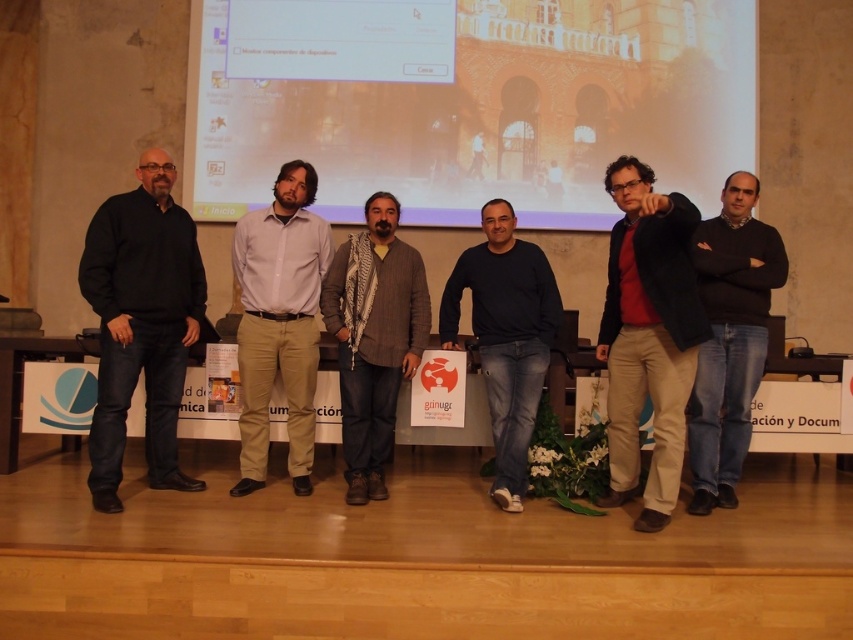
Question: Is matte projector screen at upper center to the left of dark blue sweater at center from the viewer's perspective?

Choices:
 (A) yes
 (B) no

Answer: (A)

Question: Considering the real-world distances, which object is closest to the matte black sweater at center?

Choices:
 (A) dark blue sweater at center
 (B) light brown cotton shirt at center
 (C) gray wool scarf at center

Answer: (A)

Question: Is black matte sweater at left smaller than light brown cotton shirt at center?

Choices:
 (A) no
 (B) yes

Answer: (A)

Question: Which point is closer to the camera?

Choices:
 (A) pos(398,330)
 (B) pos(741,54)
 (C) pos(752,278)

Answer: (C)

Question: Can you confirm if matte black sweater at center is smaller than gray wool scarf at center?

Choices:
 (A) yes
 (B) no

Answer: (B)

Question: Which point is closer to the camera taking this photo?

Choices:
 (A) (297, 374)
 (B) (370, 333)
 (C) (96, 248)

Answer: (C)